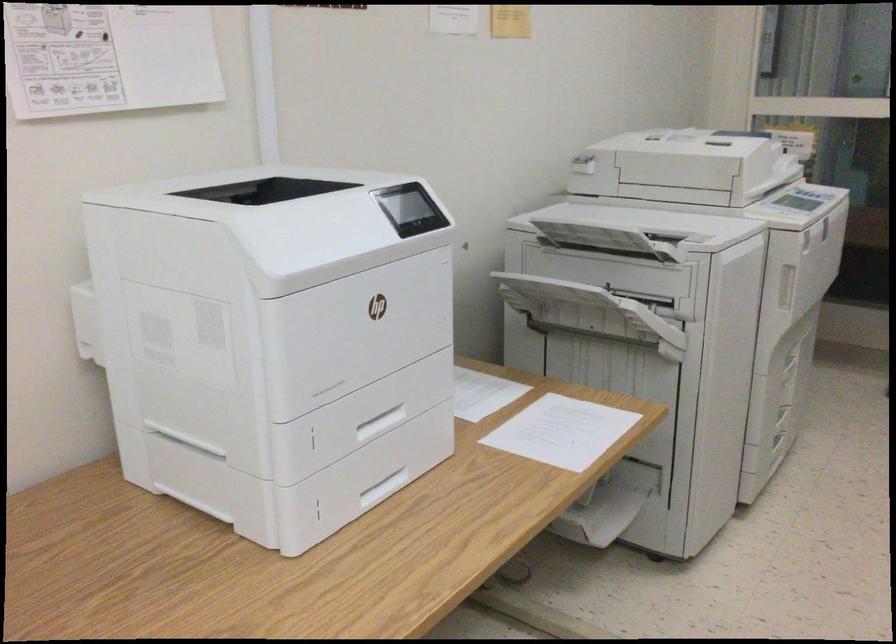
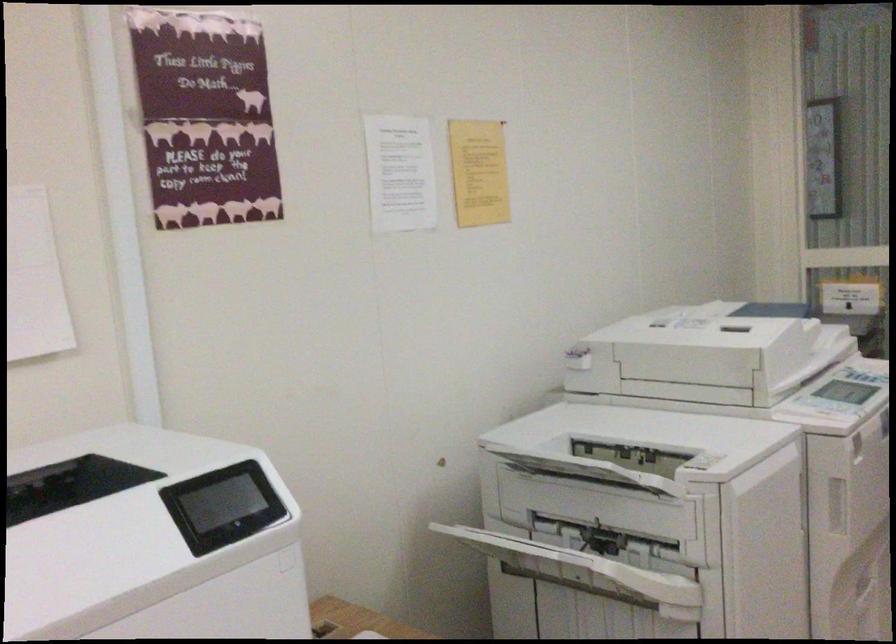
Question: How did the camera likely rotate?

Choices:
 (A) Left
 (B) Right
 (C) Up
 (D) Down

Answer: (C)